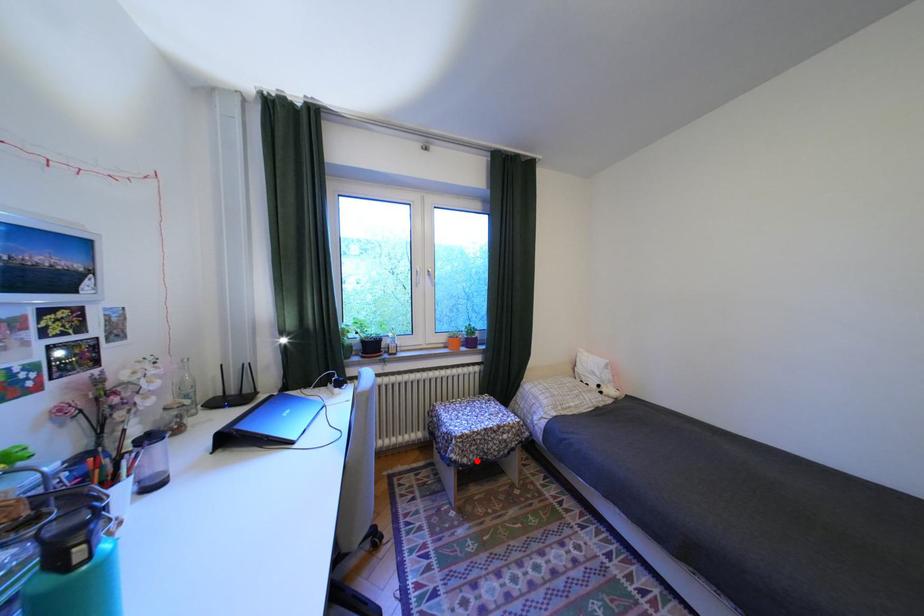
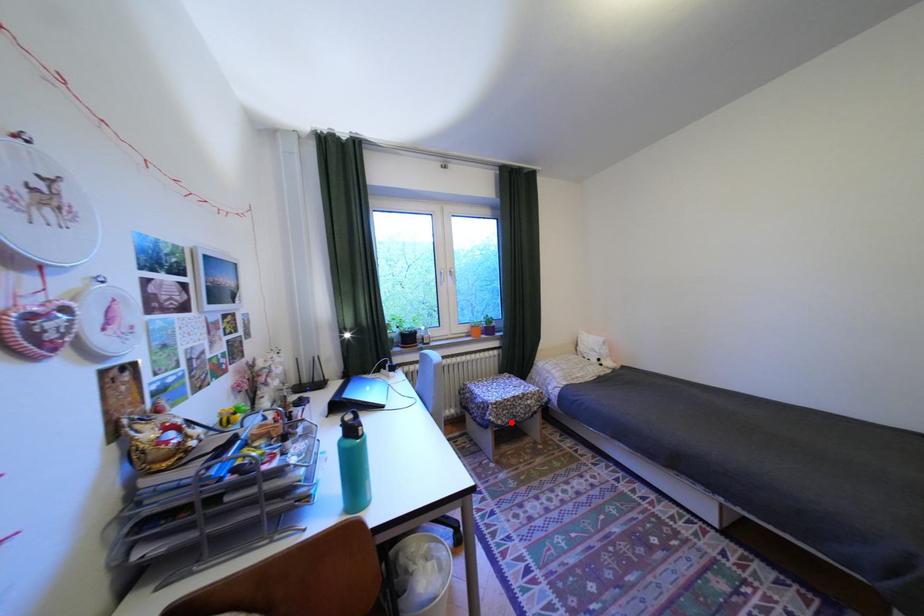
In the scene shown: I am providing you with two images of the same scene from different viewpoints. A red point is marked on the first image and another point is marked on the second image. Is the marked point in image1 the same physical position as the marked point in image2?

Yes